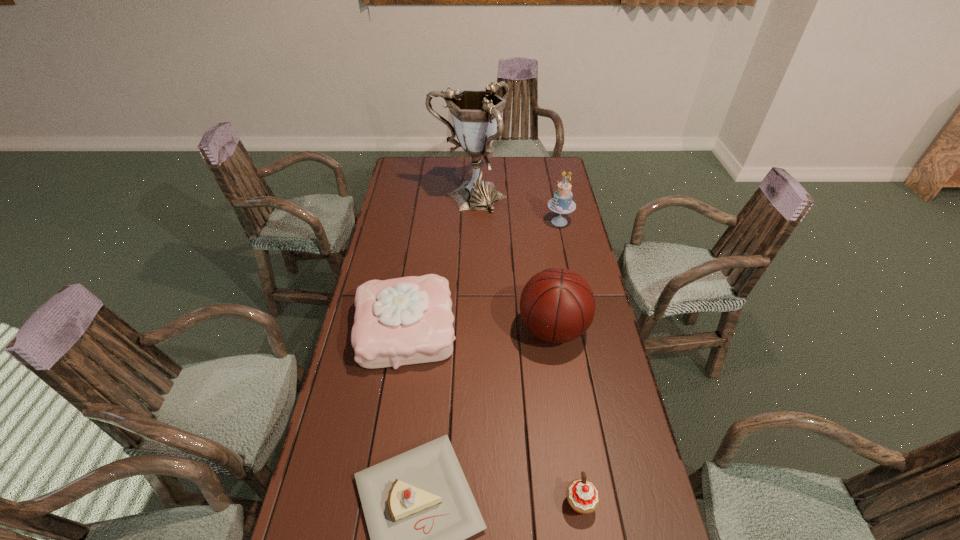
You are a GUI agent. You are given a task and a screenshot of the screen. Output one action in this format:
    pyautogui.click(x=<x>, y=<y>)
    Task: Click on the trophy cup
    Image resolution: width=960 pixels, height=540 pixels.
    Given the screenshot: What is the action you would take?
    pyautogui.click(x=476, y=114)

Locate an element on the screen. The image size is (960, 540). the rightmost cake is located at coordinates (562, 203).

At what (x,y) coordinates should I click in order to perform the action: click on the farthest cake. Please return your answer as a coordinate pair (x, y). The width and height of the screenshot is (960, 540). Looking at the image, I should click on (562, 203).

You are a GUI agent. You are given a task and a screenshot of the screen. Output one action in this format:
    pyautogui.click(x=<x>, y=<y>)
    Task: Click on the basketball
    This screenshot has width=960, height=540.
    Given the screenshot: What is the action you would take?
    click(557, 305)

Find the location of `the third shortest object`. the third shortest object is located at coordinates (408, 320).

You are a GUI agent. You are given a task and a screenshot of the screen. Output one action in this format:
    pyautogui.click(x=<x>, y=<y>)
    Task: Click on the second farthest cake
    
    Given the screenshot: What is the action you would take?
    pyautogui.click(x=408, y=320)

This screenshot has width=960, height=540. I want to click on cupcake, so click(x=582, y=495).

Identify the location of blank space located on the back of the tallest object. The height and width of the screenshot is (540, 960). (470, 168).

Where is `free space located 0.300m with a ladder on the side of the rightmost cake`? This screenshot has height=540, width=960. free space located 0.300m with a ladder on the side of the rightmost cake is located at coordinates (477, 222).

Find the location of a particular element. free location located with a ladder on the side of the rightmost cake is located at coordinates (514, 222).